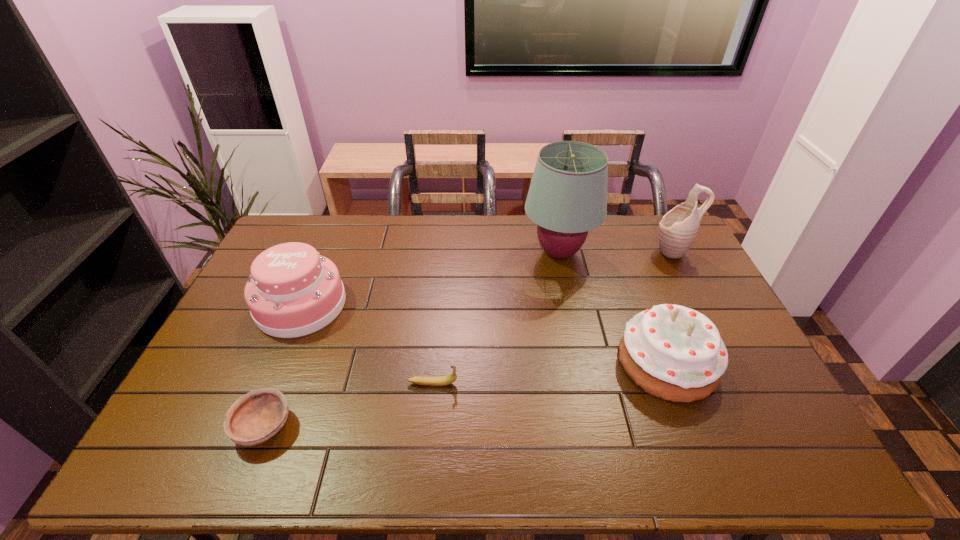
Where is `lampshade`? The image size is (960, 540). lampshade is located at coordinates (567, 197).

The width and height of the screenshot is (960, 540). Identify the location of the second tallest object. (677, 230).

At what (x,y) coordinates should I click in order to perform the action: click on the left cake. Please return your answer as a coordinate pair (x, y). Looking at the image, I should click on (292, 291).

The image size is (960, 540). In order to click on the right cake in this screenshot , I will do `click(675, 353)`.

Locate an element on the screen. the fourth object from right to left is located at coordinates (445, 380).

This screenshot has height=540, width=960. Identify the location of the second shortest object. (445, 380).

At what (x,y) coordinates should I click in order to perform the action: click on bowl. Please return your answer as a coordinate pair (x, y). The width and height of the screenshot is (960, 540). Looking at the image, I should click on (254, 418).

Where is `vacant space situated 0.300m on the front of the lampshade`? Image resolution: width=960 pixels, height=540 pixels. vacant space situated 0.300m on the front of the lampshade is located at coordinates (579, 347).

Identify the location of vacant space located 0.320m at the spout of the pitcher. The width and height of the screenshot is (960, 540). (564, 252).

Locate an element on the screen. vacant space located at the spout of the pitcher is located at coordinates (597, 252).